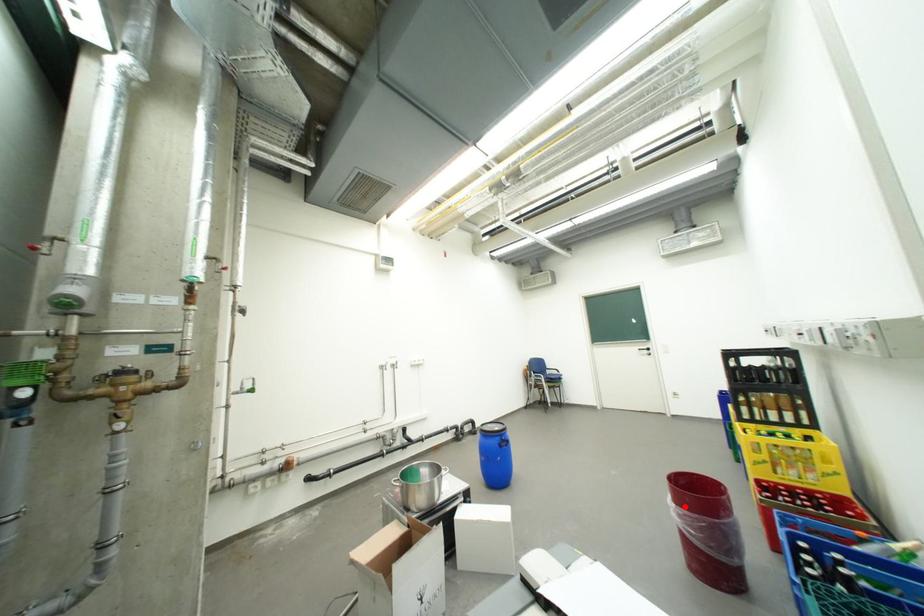
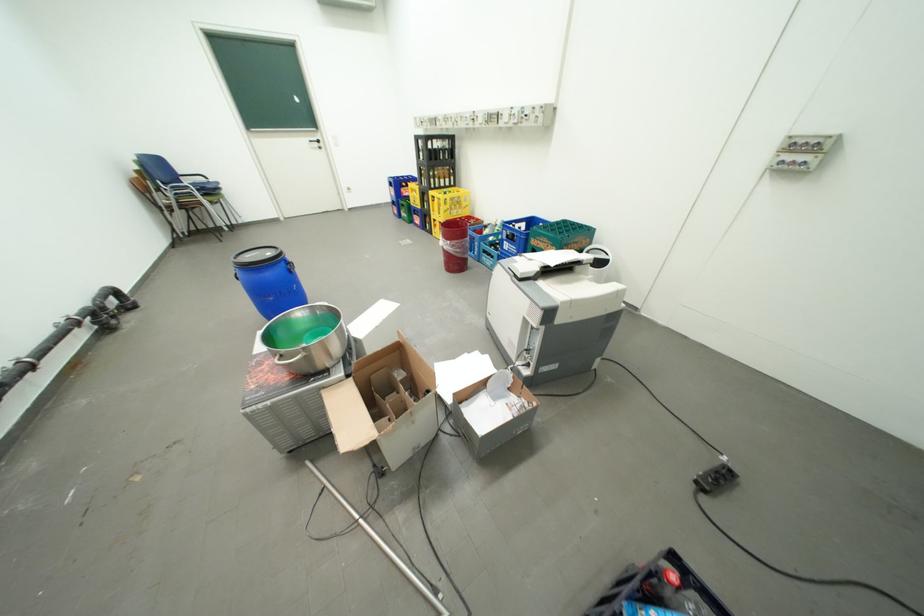
The point at the highlighted location is marked in the first image. Where is the corresponding point in the second image?

(459, 243)